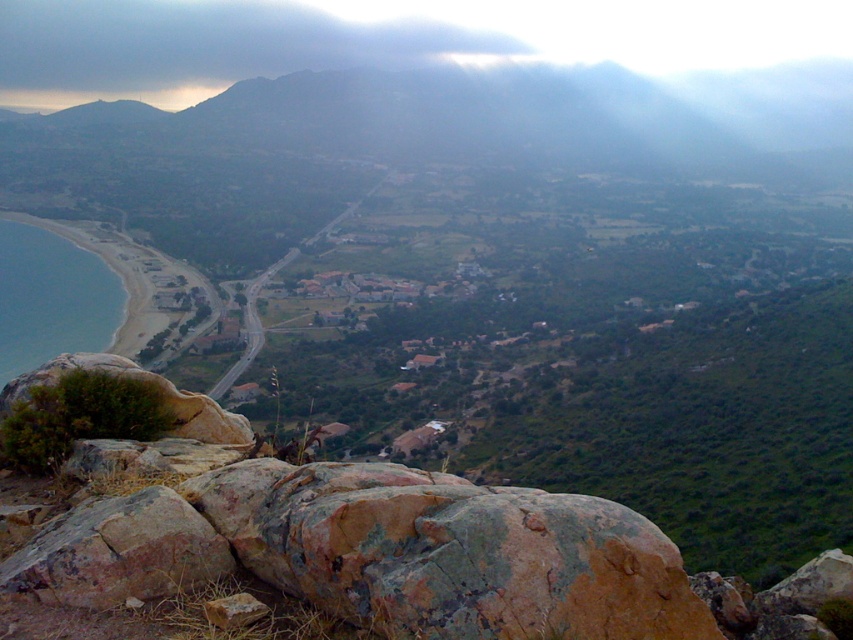
You are standing at the highest point of the coastal landscape and want to reach the rusty stone boulder at lower left. Which direction should you head to from your current position?

The rusty stone boulder at lower left is located at point (412, 556), which is in the lower left direction from your current vantage point. You should head downwards and towards the left to reach it.

You are a hiker standing at the top of the rocky outcrop. You want to reach the translucent blue water at lower left without getting wet. The rusty stone boulder at lower left is in your path. Can you walk around it? Please explain your reasoning based on the distance between them.

The rusty stone boulder at lower left and the translucent blue water at lower left are 326.76 feet apart. Since the distance is significant, you can walk around the rusty stone boulder at lower left to reach the translucent blue water at lower left without getting wet.

You are standing at the highest point of the rocky outcrop in the foreground. You see a point marked at coordinates (x=412, y=556). What object is located at that point?

The point at coordinates (x=412, y=556) corresponds to the rusty stone boulder at lower left.